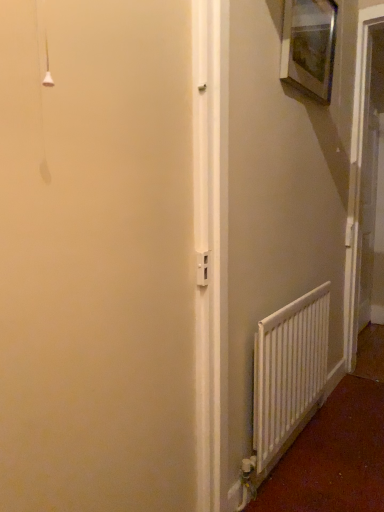
The image size is (384, 512). I want to click on wooden picture frame at upper right, so click(x=309, y=46).

Where is `white plastic screen door at right`? white plastic screen door at right is located at coordinates (366, 187).

This screenshot has height=512, width=384. I want to click on white matte radiator at lower right, so click(x=289, y=370).

I want to click on wooden picture frame at upper right, so click(309, 46).

How much distance is there between white plastic screen door at right and wooden picture frame at upper right?

The distance of white plastic screen door at right from wooden picture frame at upper right is 28.97 inches.

Could you tell me if white plastic screen door at right is turned towards wooden picture frame at upper right?

No.

Considering the positions of point (348, 329) and point (299, 84), is point (348, 329) closer or farther from the camera than point (299, 84)?

Point (348, 329) is positioned farther from the camera compared to point (299, 84).

The height and width of the screenshot is (512, 384). I want to click on picture frame located in front of the white plastic screen door at right, so click(x=309, y=46).

Are white matte radiator at lower right and white plastic screen door at right beside each other?

No.

From the image's perspective, between white matte radiator at lower right and white plastic screen door at right, who is located below?

white matte radiator at lower right, from the image's perspective.

From a real-world perspective, who is located higher, white matte radiator at lower right or white plastic screen door at right?

In real-world perspective, white plastic screen door at right is above.

Considering the sizes of objects white matte radiator at lower right and white plastic screen door at right in the image provided, who is shorter, white matte radiator at lower right or white plastic screen door at right?

Standing shorter between the two is white matte radiator at lower right.

Could you tell me if wooden picture frame at upper right is turned towards white plastic screen door at right?

No, wooden picture frame at upper right is not turned towards white plastic screen door at right.

Which of these two, wooden picture frame at upper right or white plastic screen door at right, is bigger?

white plastic screen door at right is bigger.

Can you confirm if wooden picture frame at upper right is positioned to the right of white plastic screen door at right?

No.

From a real-world perspective, is wooden picture frame at upper right located beneath white plastic screen door at right?

Actually, wooden picture frame at upper right is physically above white plastic screen door at right in the real world.

Looking at this image, is white matte radiator at lower right at the back of white plastic screen door at right?

No, white plastic screen door at right is not facing the opposite direction of white matte radiator at lower right.

From a real-world perspective, which object rests below the other?

From a 3D spatial view, white matte radiator at lower right is below.

Which is further, [364,215] or [285,378]?

Point [364,215]

Consider the image. Is white plastic screen door at right positioned beyond the bounds of white matte radiator at lower right?

Yes.

Based on the photo, from a real-world perspective, who is located lower, white matte radiator at lower right or wooden picture frame at upper right?

white matte radiator at lower right, from a real-world perspective.

Can you see white matte radiator at lower right touching wooden picture frame at upper right?

No, white matte radiator at lower right is not making contact with wooden picture frame at upper right.

Is white matte radiator at lower right taller or shorter than wooden picture frame at upper right?

In the image, white matte radiator at lower right appears to be taller than wooden picture frame at upper right.

How far apart are wooden picture frame at upper right and white matte radiator at lower right?

wooden picture frame at upper right is 3.39 feet away from white matte radiator at lower right.

Considering the sizes of objects wooden picture frame at upper right and white matte radiator at lower right in the image provided, who is smaller, wooden picture frame at upper right or white matte radiator at lower right?

wooden picture frame at upper right is smaller.

Considering the relative positions of wooden picture frame at upper right and white matte radiator at lower right in the image provided, is wooden picture frame at upper right to the right of white matte radiator at lower right from the viewer's perspective?

Correct, you'll find wooden picture frame at upper right to the right of white matte radiator at lower right.

Looking at this image, is wooden picture frame at upper right shorter than white matte radiator at lower right?

Correct, wooden picture frame at upper right is not as tall as white matte radiator at lower right.

This screenshot has width=384, height=512. What are the coordinates of `screen door on the right of the wooden picture frame at upper right` in the screenshot? It's located at (366, 187).

You are a GUI agent. You are given a task and a screenshot of the screen. Output one action in this format:
    pyautogui.click(x=<x>, y=<y>)
    Task: Click on the radiator in front of the white plastic screen door at right
    This screenshot has width=384, height=512.
    Given the screenshot: What is the action you would take?
    pyautogui.click(x=289, y=370)

Looking at the image, which one is located further to wooden picture frame at upper right, white matte radiator at lower right or white plastic screen door at right?

The object further to wooden picture frame at upper right is white matte radiator at lower right.

Based on their spatial positions, is wooden picture frame at upper right or white plastic screen door at right further from white matte radiator at lower right?

wooden picture frame at upper right.

Estimate the real-world distances between objects in this image. Which object is further from wooden picture frame at upper right, white plastic screen door at right or white matte radiator at lower right?

white matte radiator at lower right is further to wooden picture frame at upper right.

Considering their positions, is white plastic screen door at right positioned further to white matte radiator at lower right than wooden picture frame at upper right?

wooden picture frame at upper right.

Looking at the image, which one is located closer to white plastic screen door at right, wooden picture frame at upper right or white matte radiator at lower right?

wooden picture frame at upper right is positioned closer to the anchor white plastic screen door at right.

In the scene shown: Which object lies nearer to the anchor point white plastic screen door at right, white matte radiator at lower right or wooden picture frame at upper right?

wooden picture frame at upper right.

Where is `screen door between wooden picture frame at upper right and white matte radiator at lower right in the up-down direction`? The height and width of the screenshot is (512, 384). screen door between wooden picture frame at upper right and white matte radiator at lower right in the up-down direction is located at coordinates (366, 187).